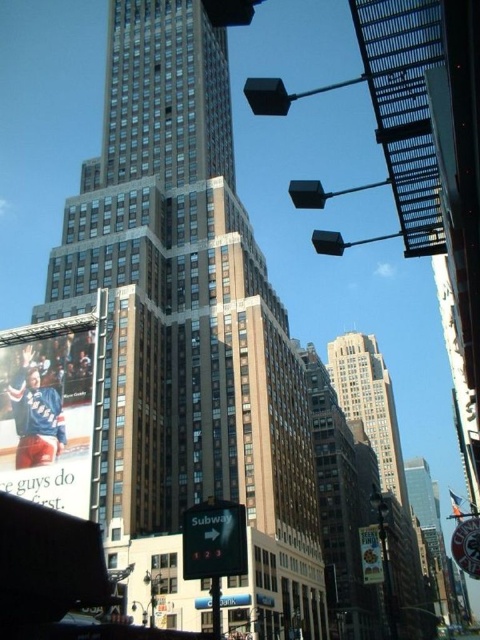
From the picture: You are a pedestrian standing on the street looking at the scene. You see the white glossy hockey player at lower left and the metallic silver sign at lower right. Which object is closer to you?

The white glossy hockey player at lower left is closer to you because it is further to the viewer than the metallic silver sign at lower right.

You are standing at the intersection and need to locate the green matte sign at lower center. According to the scene description, where should you look relative to the central beige facade building?

The green matte sign at lower center is located at point (x=214, y=540) in the image, which is in the lower central area relative to the central beige facade building.

You are a delivery driver navigating through the city. You see the point marked at coordinates (214,540). What object is located at this point?

The point marked at coordinates (214,540) marks the green matte sign at lower center.